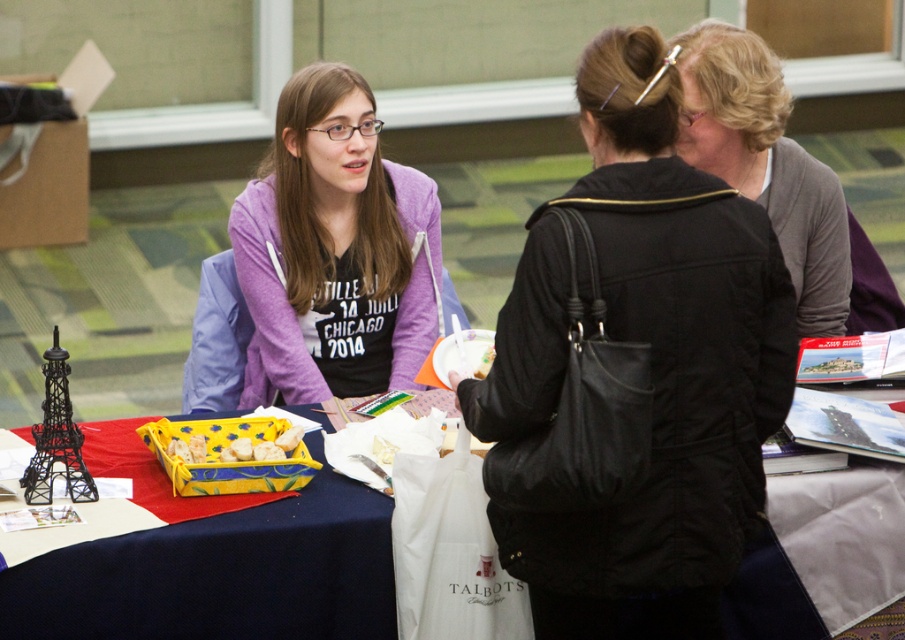
Question: Does black leather jacket at center have a smaller size compared to gray sweater at upper right?

Choices:
 (A) yes
 (B) no

Answer: (B)

Question: Among these points, which one is nearest to the camera?

Choices:
 (A) (287, 440)
 (B) (665, 508)
 (C) (36, 429)
 (D) (350, 189)

Answer: (B)

Question: Which point is farther to the camera?

Choices:
 (A) (843, 314)
 (B) (84, 490)
 (C) (794, 508)
 (D) (787, 336)

Answer: (A)

Question: Is black leather jacket at center further to camera compared to black matte eiffel tower at left?

Choices:
 (A) no
 (B) yes

Answer: (A)

Question: Is blue fabric table at center wider than yellow fabric basket at center?

Choices:
 (A) no
 (B) yes

Answer: (B)

Question: Which object is the farthest from the purple fleece jacket at center?

Choices:
 (A) blue fabric table at center
 (B) black leather jacket at center

Answer: (B)